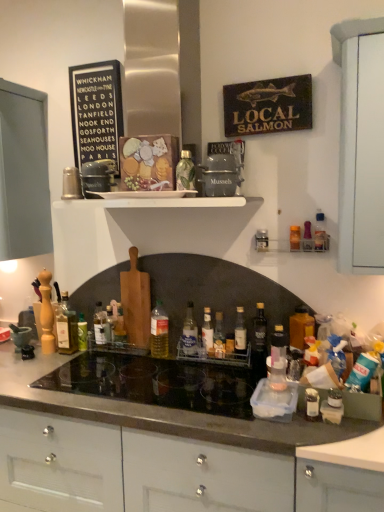
Question: Choose the correct answer: Is white glossy shelf at upper center inside clear glass bottle at center, placed as the 7th bottle when sorted from left to right, or outside it?

Choices:
 (A) outside
 (B) inside

Answer: (A)

Question: Is white glossy shelf at upper center taller or shorter than clear glass bottle at center, which is the sixth bottle from right to left?

Choices:
 (A) tall
 (B) short

Answer: (B)

Question: Which of these objects is positioned closest to the clear glass bottle at center, placed as the 7th bottle when sorted from left to right?

Choices:
 (A) translucent glass bottle at left, the 1th bottle in the left-to-right sequence
 (B) smooth gray countertop at center
 (C) translucent plastic bottle at right, which is counted as the twelfth bottle, starting from the left
 (D) translucent glass bottle at center, which appears as the third bottle when viewed from the left
 (E) black glass cooktop at center

Answer: (E)

Question: Estimate the real-world distances between objects in this image. Which object is farther from the green glass bottle at upper center, which is counted as the fifth bottle, starting from the left?

Choices:
 (A) translucent glass bottle at center, placed as the 4th bottle when sorted from right to left
 (B) smooth gray countertop at center
 (C) translucent plastic bottle at center, the fourth bottle from the left
 (D) black glass cooktop at center
 (E) green glass bottle at center, which is the eleventh bottle in right-to-left order

Answer: (E)